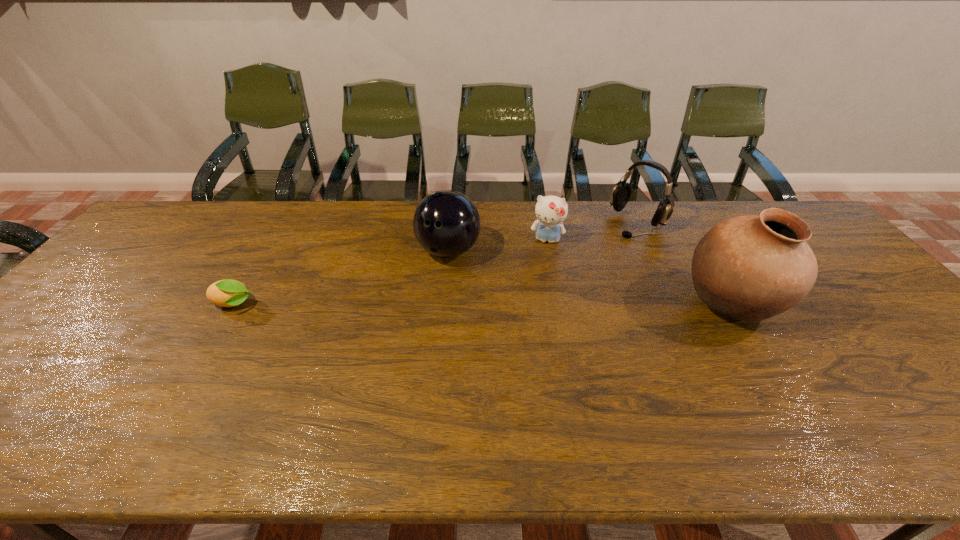
You are a GUI agent. You are given a task and a screenshot of the screen. Output one action in this format:
    pyautogui.click(x=<x>, y=<y>)
    Task: Click on the lemon
    The width and height of the screenshot is (960, 540).
    Given the screenshot: What is the action you would take?
    pyautogui.click(x=227, y=293)

The width and height of the screenshot is (960, 540). I want to click on the leftmost object, so click(x=227, y=293).

The height and width of the screenshot is (540, 960). Find the location of `pottery`. pottery is located at coordinates (751, 268).

Find the location of `kitten`. kitten is located at coordinates (551, 211).

Identify the location of the second shortest object. This screenshot has width=960, height=540. (551, 211).

Image resolution: width=960 pixels, height=540 pixels. In order to click on headset in this screenshot , I will do `click(621, 193)`.

I want to click on the second object from left to right, so click(446, 223).

Where is `free region located 0.300m with leaves positioned above the shortest object`? Image resolution: width=960 pixels, height=540 pixels. free region located 0.300m with leaves positioned above the shortest object is located at coordinates click(369, 305).

Where is `free location located on the back of the tallest object`? The image size is (960, 540). free location located on the back of the tallest object is located at coordinates (668, 201).

This screenshot has width=960, height=540. Find the location of `free space located on the front-facing side of the kitten`. free space located on the front-facing side of the kitten is located at coordinates (536, 291).